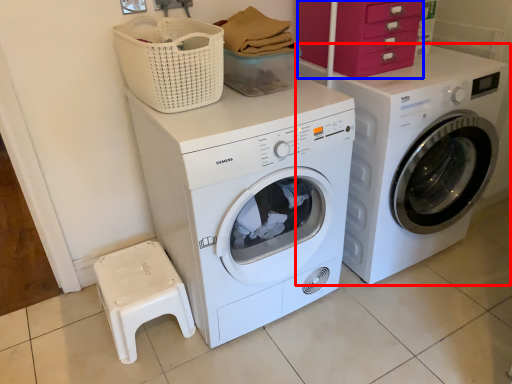
Question: Which object appears farthest to the camera in this image, washing machine (highlighted by a red box) or drawer (highlighted by a blue box)?

Choices:
 (A) washing machine
 (B) drawer

Answer: (B)